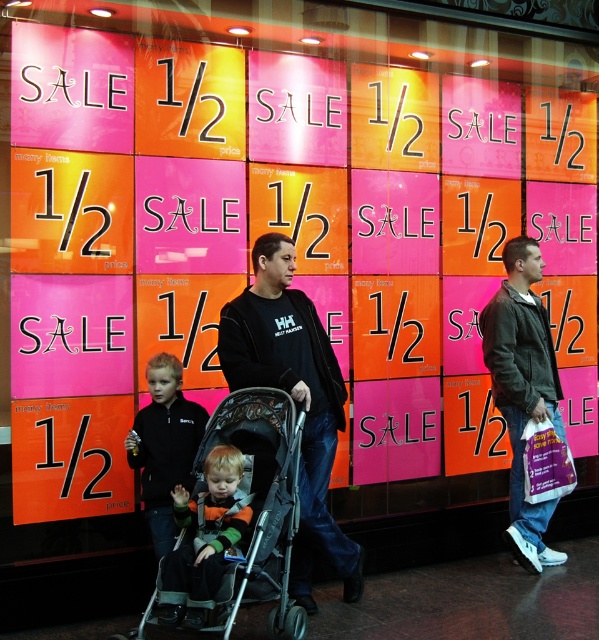
Question: Is black softshell jacket at center thinner than green fleece jacket at center?

Choices:
 (A) yes
 (B) no

Answer: (B)

Question: Which point appears farthest from the camera in this image?

Choices:
 (A) (292, 310)
 (B) (179, 595)
 (C) (168, 424)

Answer: (A)

Question: Considering the real-world distances, which object is closest to the black fleece jacket at center?

Choices:
 (A) dark green jacket at right
 (B) black softshell jacket at center
 (C) black textured stroller at center
 (D) green fleece jacket at center

Answer: (D)

Question: Estimate the real-world distances between objects in this image. Which object is closer to the black fleece jacket at center?

Choices:
 (A) green fleece jacket at center
 (B) black softshell jacket at center
 (C) black textured stroller at center

Answer: (A)

Question: Does black softshell jacket at center come behind black fleece jacket at center?

Choices:
 (A) yes
 (B) no

Answer: (B)

Question: Is black softshell jacket at center positioned at the back of black textured stroller at center?

Choices:
 (A) no
 (B) yes

Answer: (B)